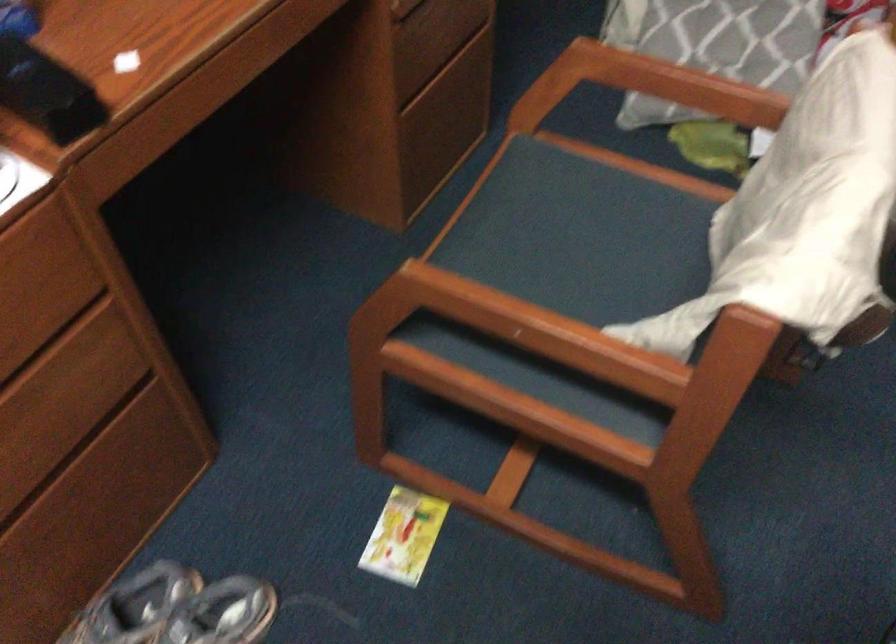
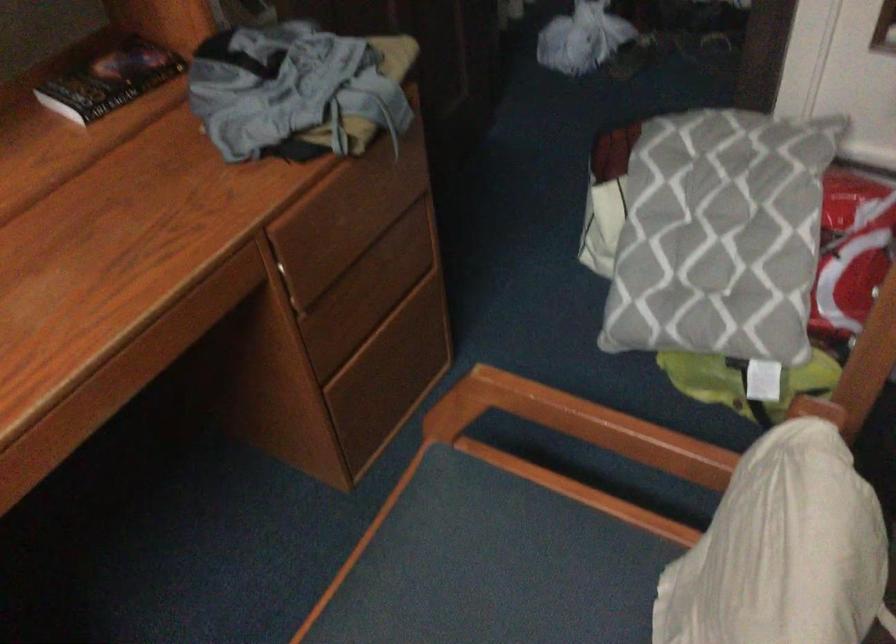
Question: The images are taken continuously from a first-person perspective. In which direction is your viewpoint rotating?

Choices:
 (A) Left
 (B) Right
 (C) Up
 (D) Down

Answer: (C)